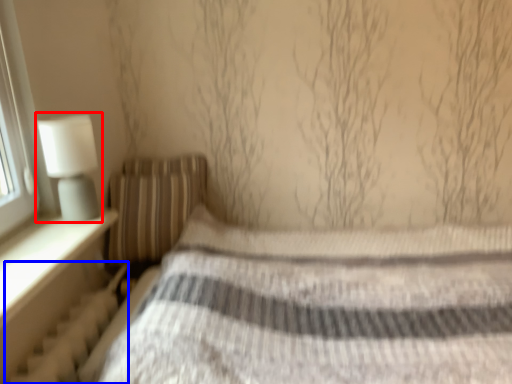
Question: Which point is closer to the camera, table lamp (highlighted by a red box) or radiator (highlighted by a blue box)?

Choices:
 (A) table lamp
 (B) radiator

Answer: (B)